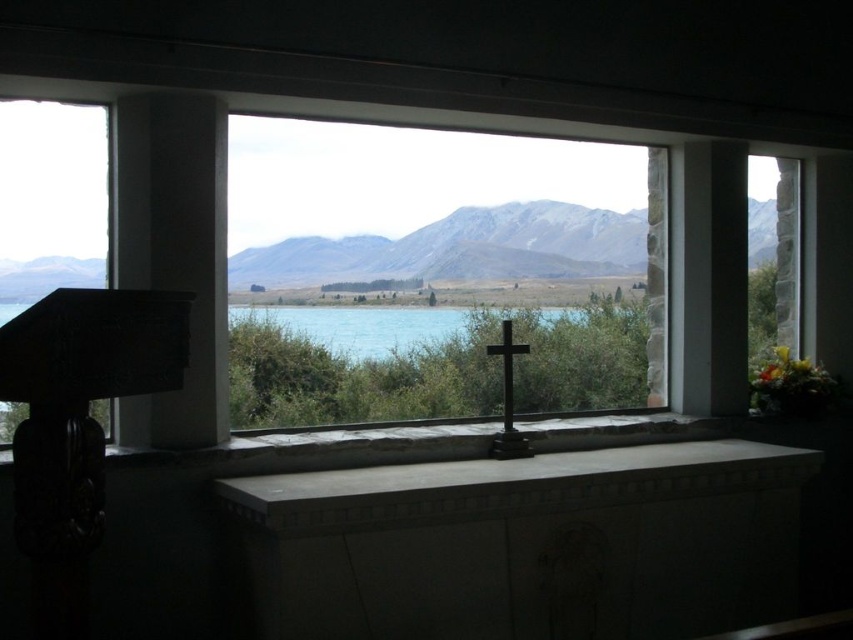
Which is in front, point (622, 472) or point (431, 332)?

Positioned in front is point (622, 472).

Is white marble window sill at center thinner than turquoise water at center?

No, white marble window sill at center is not thinner than turquoise water at center.

Does point (659, 481) come in front of point (236, 349)?

Yes.

Where is `white marble window sill at center`? The height and width of the screenshot is (640, 853). white marble window sill at center is located at coordinates (509, 484).

Does white marble window sill at center have a smaller size compared to transparent glass window at left?

No, white marble window sill at center is not smaller than transparent glass window at left.

Which is more to the left, white marble window sill at center or transparent glass window at left?

Positioned to the left is transparent glass window at left.

Image resolution: width=853 pixels, height=640 pixels. What do you see at coordinates (509, 484) in the screenshot? I see `white marble window sill at center` at bounding box center [509, 484].

At what (x,y) coordinates should I click in order to perform the action: click on white marble window sill at center. Please return your answer as a coordinate pair (x, y). The width and height of the screenshot is (853, 640). Looking at the image, I should click on (509, 484).

Between transparent glass window at center and white marble window sill at center, which one is positioned higher?

transparent glass window at center is above.

This screenshot has width=853, height=640. Describe the element at coordinates (438, 273) in the screenshot. I see `transparent glass window at center` at that location.

This screenshot has height=640, width=853. Identify the location of transparent glass window at center. (438, 273).

At what (x,y) coordinates should I click in order to perform the action: click on transparent glass window at center. Please return your answer as a coordinate pair (x, y). Looking at the image, I should click on (438, 273).